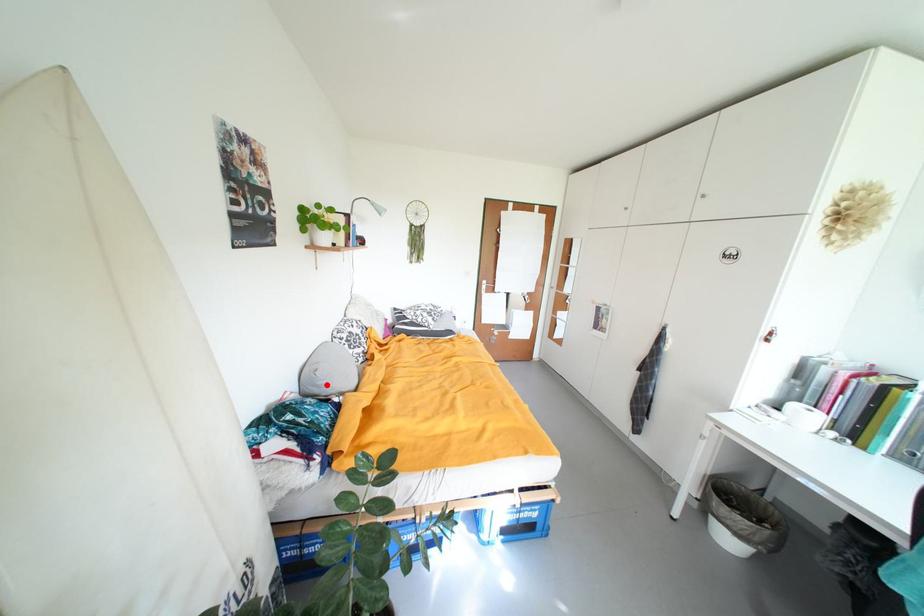
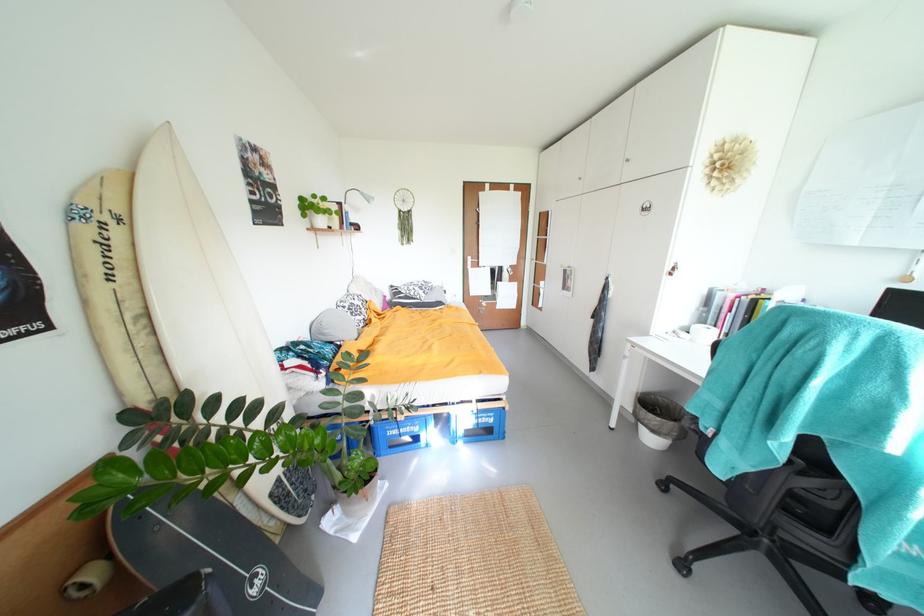
Locate, in the second image, the point that corresponds to the highlighted location in the first image.

(333, 333)